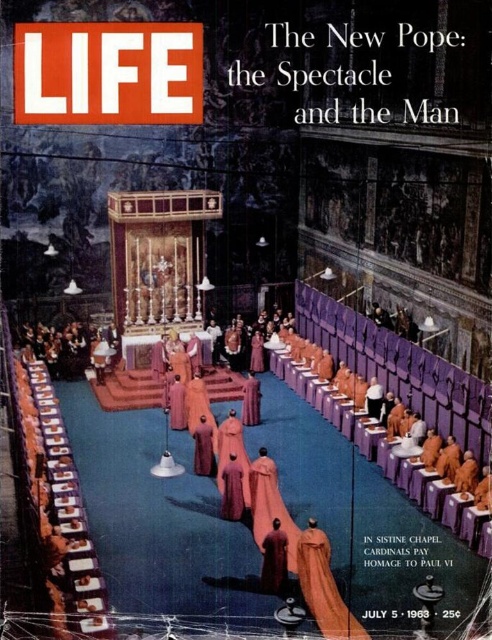
What do you see at coordinates (274, 560) in the screenshot? I see `velvet maroon robe at center` at bounding box center [274, 560].

Is velvet maroon robe at center below velvet robe at center?

Indeed, velvet maroon robe at center is positioned under velvet robe at center.

Image resolution: width=492 pixels, height=640 pixels. I want to click on velvet maroon robe at center, so click(274, 560).

Locate an element on the screen. The height and width of the screenshot is (640, 492). velvet maroon robe at center is located at coordinates (274, 560).

Is velvet robe at center thinner than purple velvet robe at center?

Indeed, velvet robe at center has a lesser width compared to purple velvet robe at center.

Is point (228, 472) farther from camera compared to point (205, 432)?

No, (228, 472) is closer to viewer.

This screenshot has width=492, height=640. What are the coordinates of `velvet robe at center` in the screenshot? It's located at (233, 490).

Which is in front, point (276, 524) or point (202, 464)?

Point (276, 524) is more forward.

Does velvet maroon robe at center have a lesser width compared to purple velvet robe at center?

Indeed, velvet maroon robe at center has a lesser width compared to purple velvet robe at center.

Image resolution: width=492 pixels, height=640 pixels. What are the coordinates of `velvet maroon robe at center` in the screenshot? It's located at (274, 560).